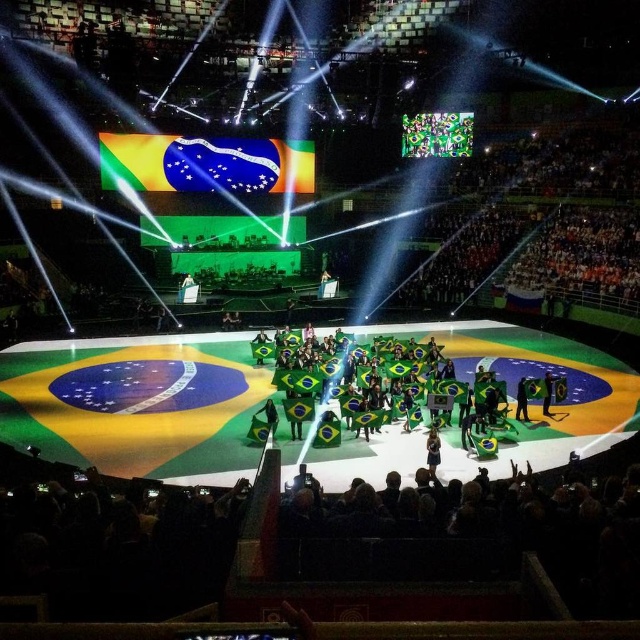
Question: Can you confirm if green fabric person at center is smaller than green fabric flag at center?

Choices:
 (A) no
 (B) yes

Answer: (B)

Question: Which object appears closest to the camera in this image?

Choices:
 (A) green fabric person at center
 (B) green fabric flag at center

Answer: (A)

Question: Is green fabric person at center wider than green fabric flag at center?

Choices:
 (A) no
 (B) yes

Answer: (A)

Question: Which object appears closest to the camera in this image?

Choices:
 (A) green fabric person at center
 (B) green fabric flag at center

Answer: (A)

Question: Can you confirm if green fabric person at center is positioned to the left of green fabric flag at center?

Choices:
 (A) yes
 (B) no

Answer: (A)

Question: Which point appears closest to the camera in this image?

Choices:
 (A) (428, 461)
 (B) (548, 381)

Answer: (A)